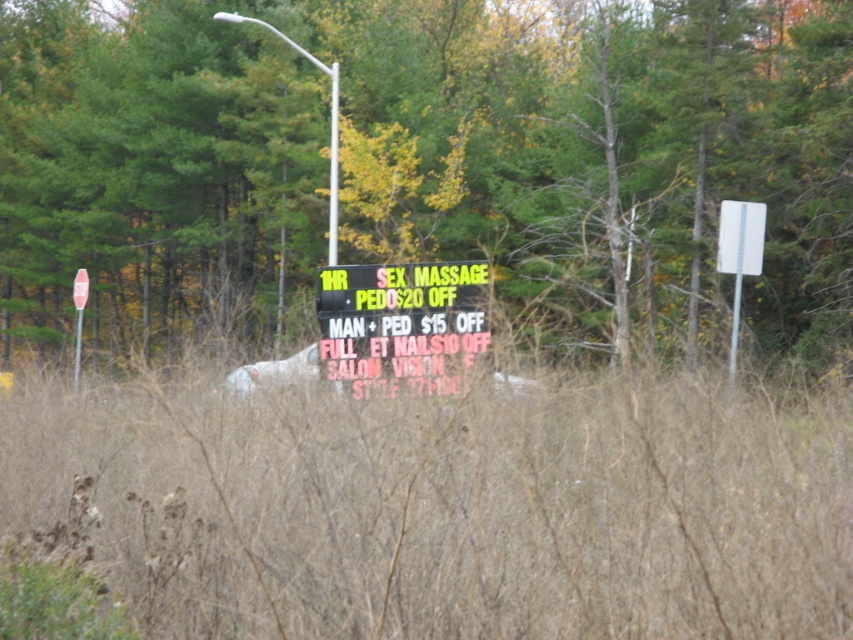
You are a delivery driver passing by the roadside scene. You need to deliver a package to the black plastic sign at center. However, your GPS says you must avoid the green leafy tree at center. Can you safely navigate around the tree to reach the sign without hitting it?

The green leafy tree at center is above the black plastic sign at center, so the tree is positioned higher than the sign. Since the tree is above the sign, it might block the path directly to the sign. However, the driver can navigate around the tree by approaching from the sides or adjusting the route to avoid collision, as the vertical position of the tree does not necessarily block the horizontal path. The driver should proceed with caution, ensuring there is enough space to maneuver around the tree and

You are standing in front of the electronic signboard and want to touch both points on the signboard. Which point should you reach for first, point (323, 13) or point (73, 394)?

You should reach for point (323, 13) first because it is closer to you than point (73, 394), which is further away.

You are a hiker who wants to take a clear photo of the black plastic sign at center without the brown dry grass at center blocking it. Based on the scene description, what should you do?

The brown dry grass at center has a larger size compared to the black plastic sign at center, so you should move closer to reduce the size of the grass in the frame, making the sign more visible.